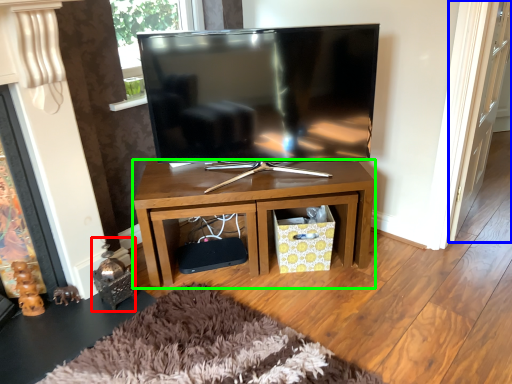
Question: Estimate the real-world distances between objects in this image. Which object is closer to toy (highlighted by a red box), glass door (highlighted by a blue box) or desk (highlighted by a green box)?

Choices:
 (A) glass door
 (B) desk

Answer: (B)